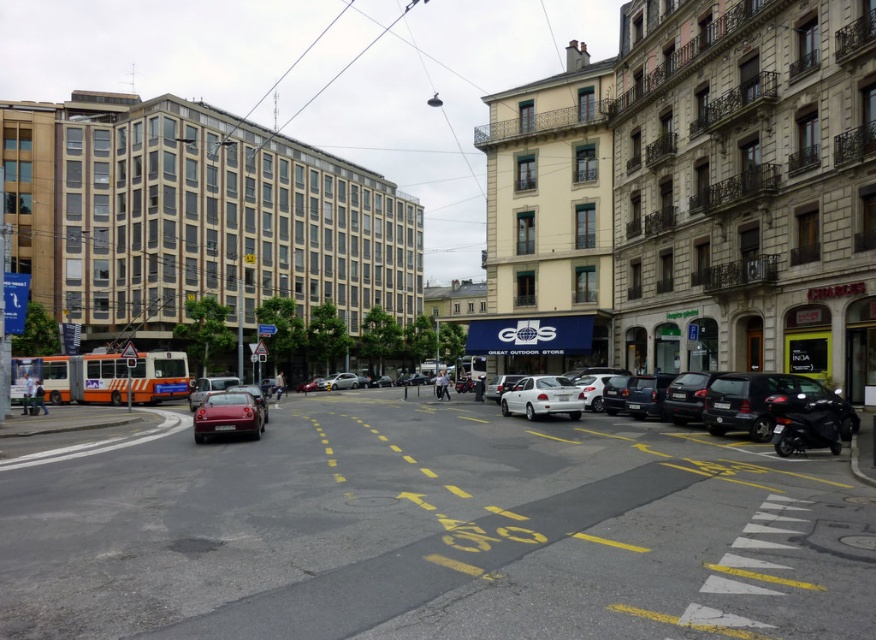
Question: Among these points, which one is farthest from the camera?

Choices:
 (A) (848, 636)
 (B) (330, 376)
 (C) (740, 381)

Answer: (B)

Question: Does white matte sedan at center-right appear under white matte car at center?

Choices:
 (A) no
 (B) yes

Answer: (A)

Question: Among these points, which one is nearest to the camera?

Choices:
 (A) (259, 419)
 (B) (283, 596)
 (C) (728, 376)

Answer: (B)

Question: Which point appears closest to the camera in this image?

Choices:
 (A) (216, 403)
 (B) (493, 396)
 (C) (200, 401)

Answer: (A)

Question: Observing the image, what is the correct spatial positioning of black matte car at right in reference to shiny silver sedan at center?

Choices:
 (A) below
 (B) above

Answer: (B)

Question: Can you confirm if shiny red car at center is positioned below shiny silver sedan at center?

Choices:
 (A) yes
 (B) no

Answer: (B)